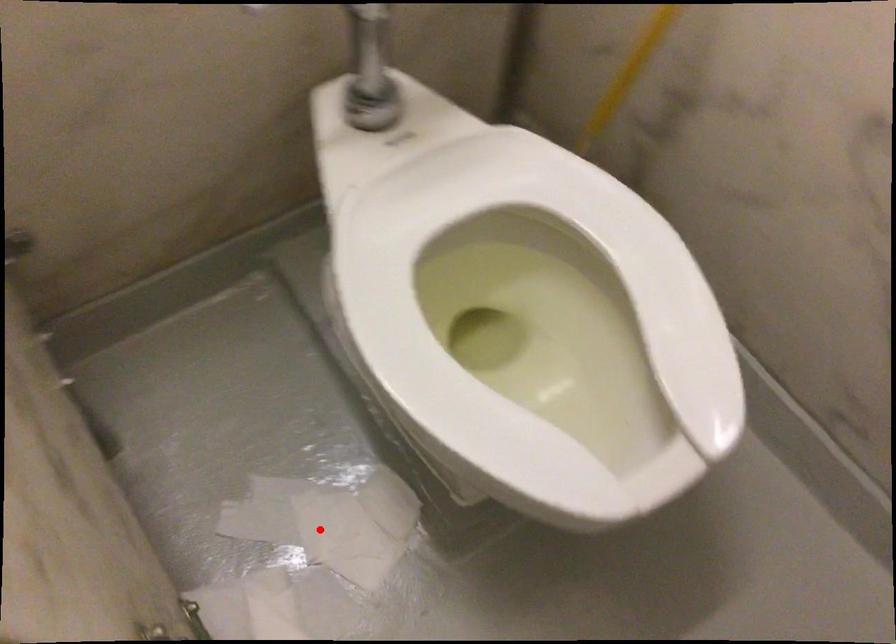
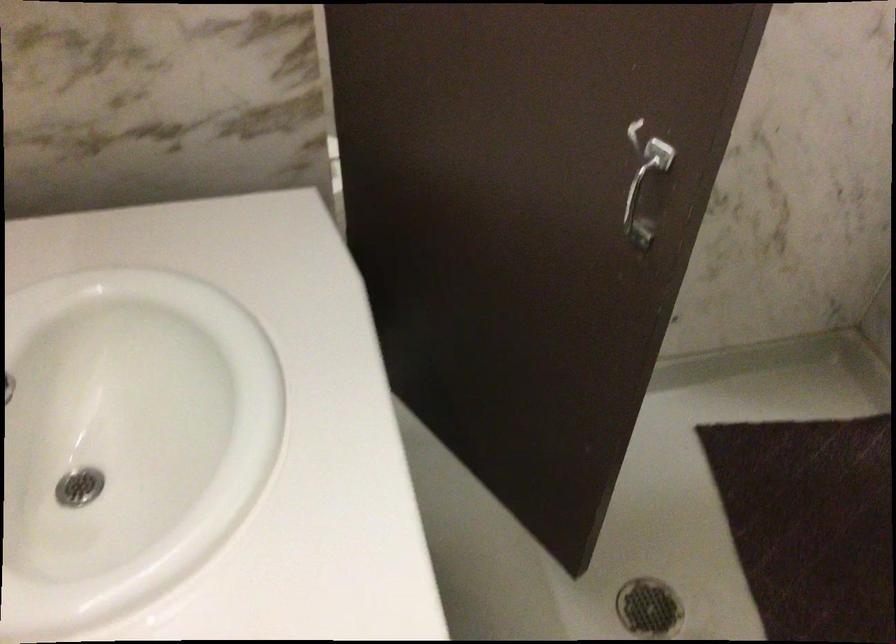
Question: I am providing you with two images of the same scene from different viewpoints. A red point is marked on the first image. Is the red point's position out of view in image 2?

Choices:
 (A) Yes
 (B) No

Answer: (A)